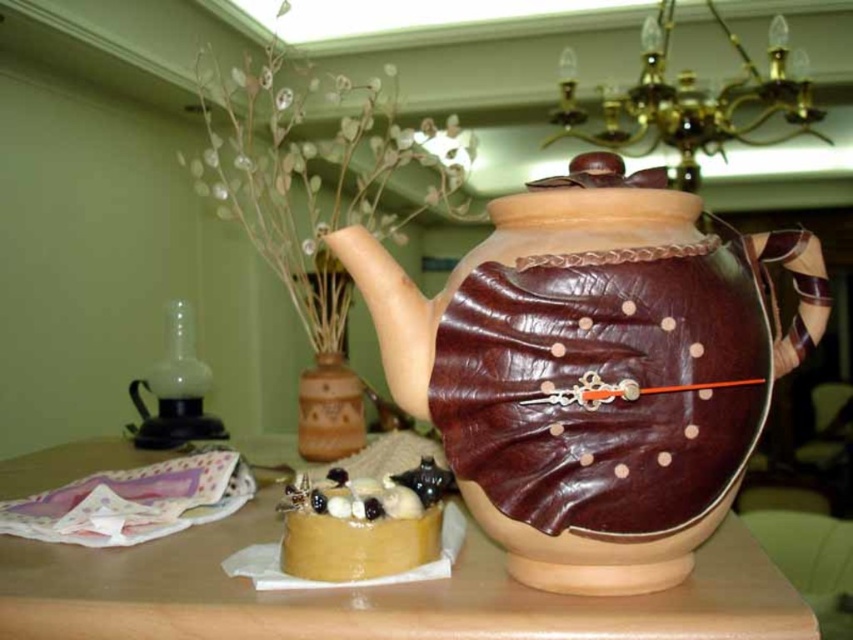
Does brown leather teapot at center appear under gold-bronze chandelier at upper center?

Yes, brown leather teapot at center is below gold-bronze chandelier at upper center.

Which is more to the left, brown leather teapot at center or gold-bronze chandelier at upper center?

brown leather teapot at center

Image resolution: width=853 pixels, height=640 pixels. Describe the element at coordinates (589, 369) in the screenshot. I see `brown leather teapot at center` at that location.

Where is `brown leather teapot at center`? Image resolution: width=853 pixels, height=640 pixels. brown leather teapot at center is located at coordinates (589, 369).

Based on the photo, measure the distance between point (573, 628) and camera.

A distance of 20.65 inches exists between point (573, 628) and camera.

Is wooden table at center shorter than smooth caramel cake at lower left?

Yes, wooden table at center is shorter than smooth caramel cake at lower left.

Between point (703, 627) and point (329, 579), which one is positioned behind?

The point (329, 579) is behind.

The image size is (853, 640). Find the location of `wooden table at center`. wooden table at center is located at coordinates pos(372,595).

What do you see at coordinates (589, 369) in the screenshot? Image resolution: width=853 pixels, height=640 pixels. I see `brown leather teapot at center` at bounding box center [589, 369].

Does point (474, 305) lie in front of point (355, 573)?

That is True.

Identify the location of brown leather teapot at center. The width and height of the screenshot is (853, 640). (589, 369).

The width and height of the screenshot is (853, 640). I want to click on brown leather teapot at center, so click(589, 369).